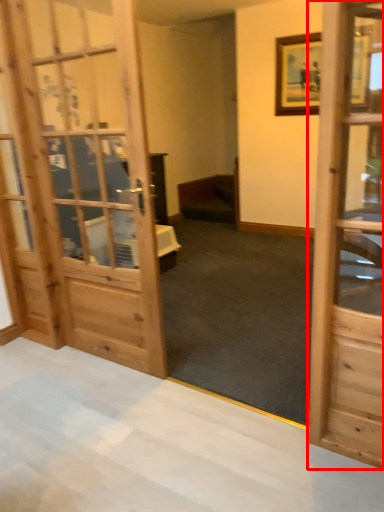
Question: From the image's perspective, where is door (annotated by the red box) located relative to furniture?

Choices:
 (A) above
 (B) below

Answer: (B)